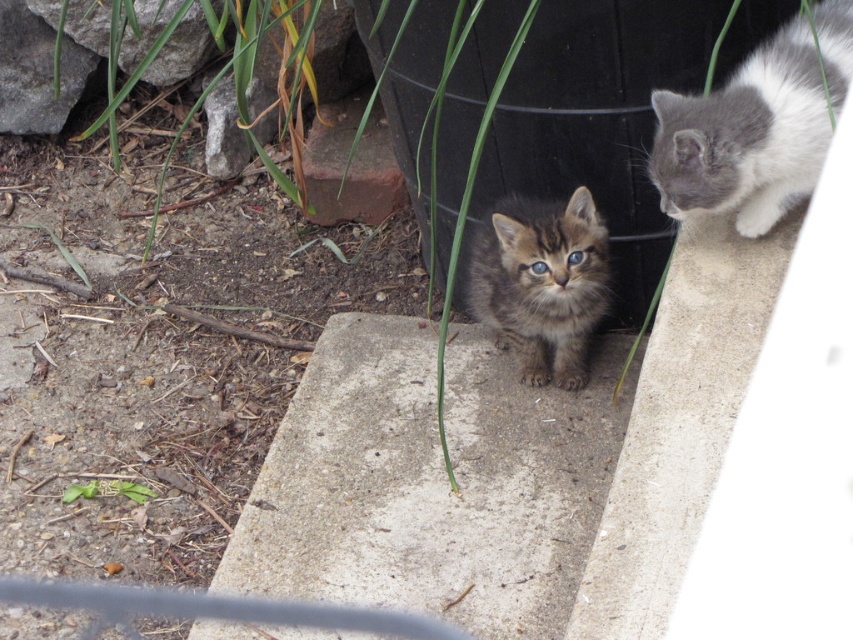
You are trying to determine which object is wider between the tabby fur kitten at center and the green leafy plant at center. Based on the scene, which one is wider?

The green leafy plant at center is wider than the tabby fur kitten at center according to the description.